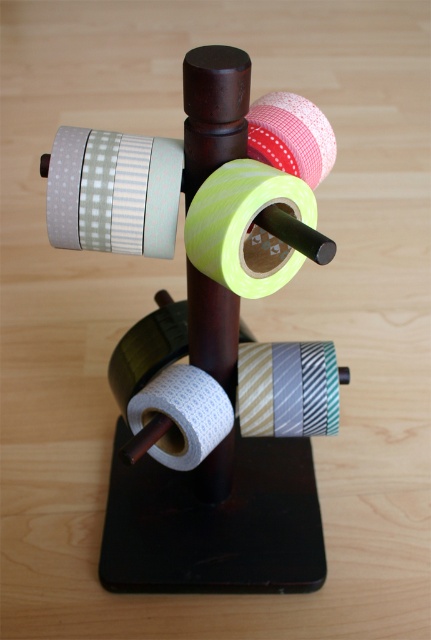
Between point (193, 244) and point (218, 433), which one is positioned in front?

Positioned in front is point (193, 244).

Is point (237, 192) positioned in front of point (227, 424)?

That is True.

Locate an element on the screen. The height and width of the screenshot is (640, 431). neon yellow matte tape at center is located at coordinates (252, 227).

Image resolution: width=431 pixels, height=640 pixels. Find the location of `matte green and white checkered tape at upper left`. matte green and white checkered tape at upper left is located at coordinates (114, 192).

Locate an element on the screen. Image resolution: width=431 pixels, height=640 pixels. matte green and white checkered tape at upper left is located at coordinates (114, 192).

The image size is (431, 640). Describe the element at coordinates (178, 417) in the screenshot. I see `white textured toilet paper at center` at that location.

Can you confirm if white textured toilet paper at center is bigger than red gingham tape at center?

Indeed, white textured toilet paper at center has a larger size compared to red gingham tape at center.

Does point (133, 404) come behind point (309, 145)?

Yes, point (133, 404) is behind point (309, 145).

Where is `white textured toilet paper at center`? The image size is (431, 640). white textured toilet paper at center is located at coordinates (178, 417).